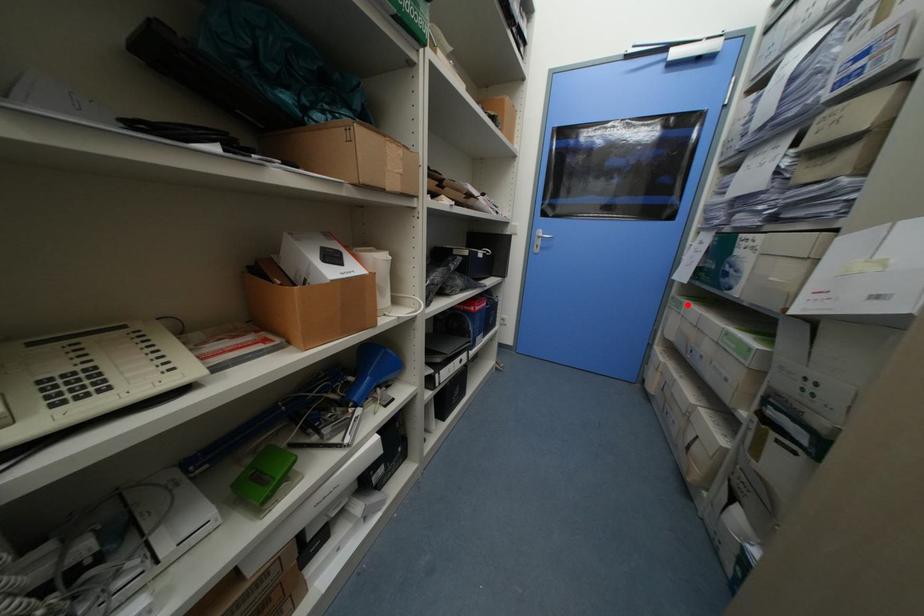
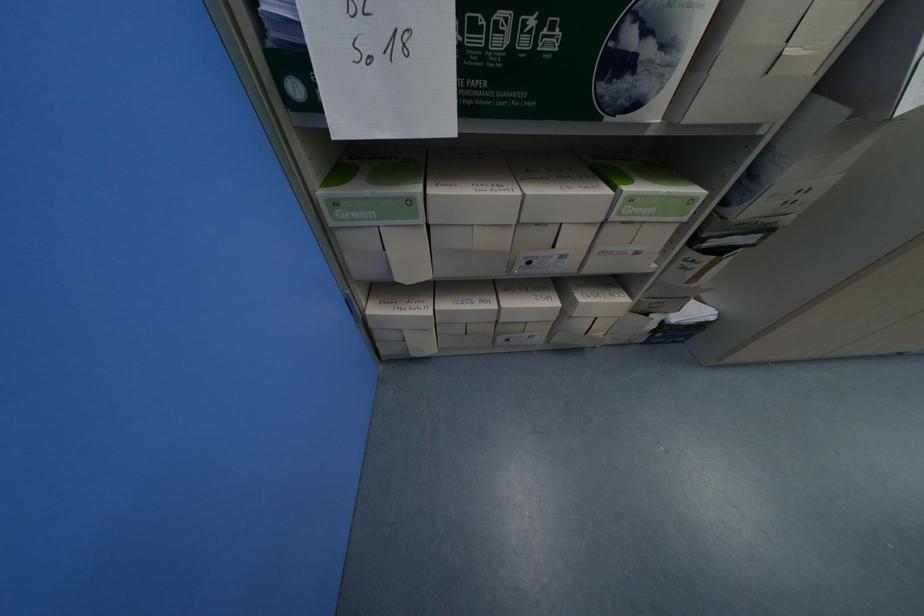
Where in the second image is the point corresponding to the highlighted location from the first image?

(417, 203)